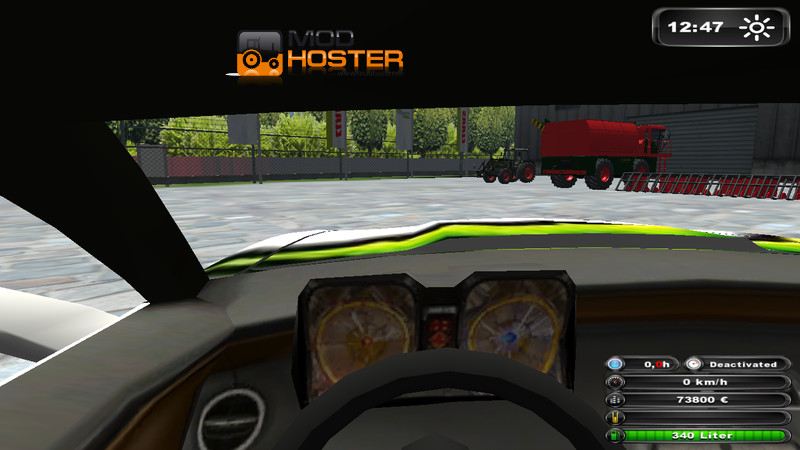
In order to click on wall in this screenshot , I will do `click(290, 169)`.